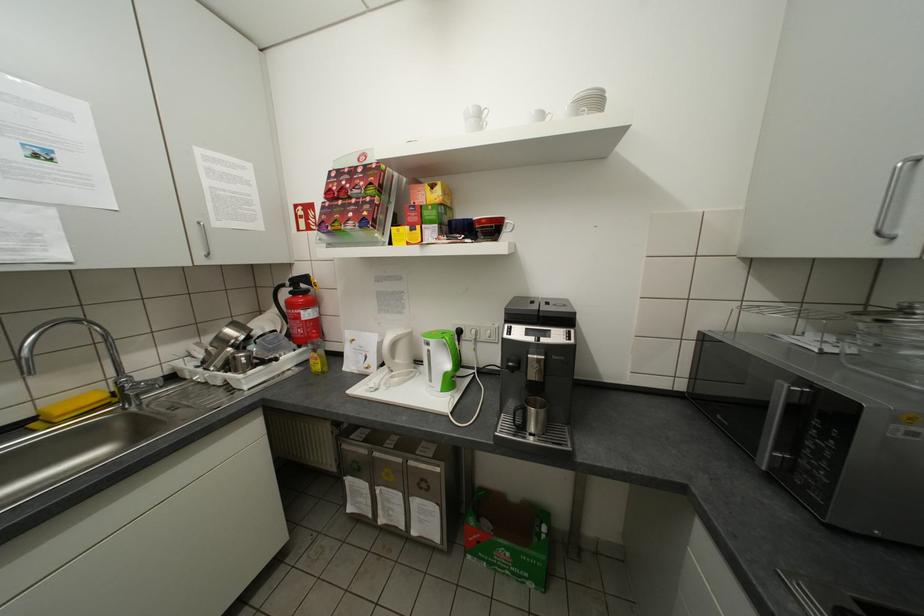
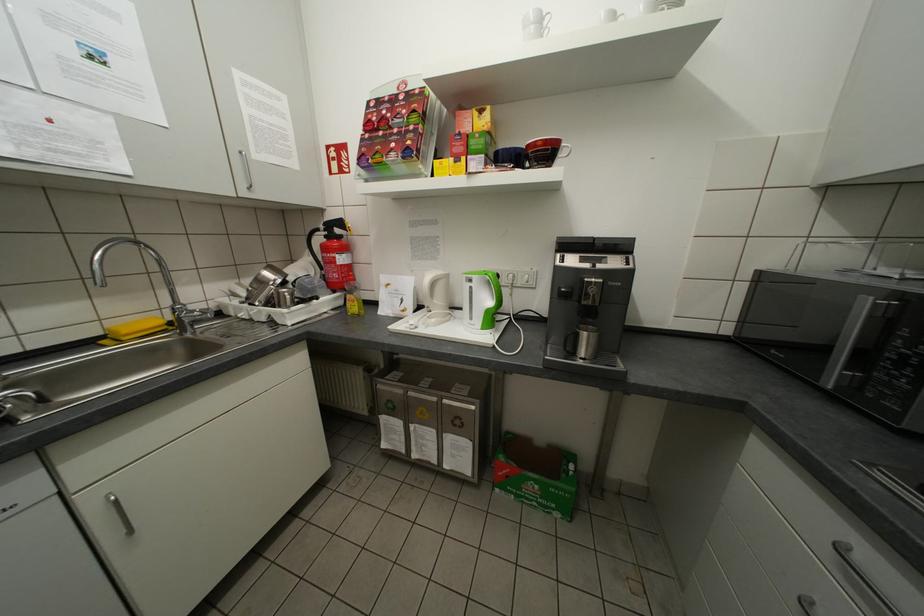
In the second image, find the point that corresponds to (537,560) in the first image.

(565, 492)